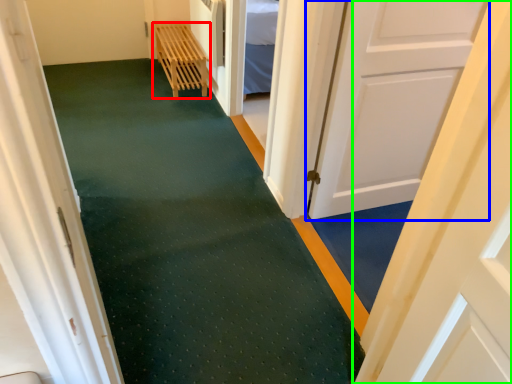
Question: Estimate the real-world distances between objects in this image. Which object is closer to furniture (highlighted by a red box), door (highlighted by a blue box) or door (highlighted by a green box)?

Choices:
 (A) door
 (B) door

Answer: (A)